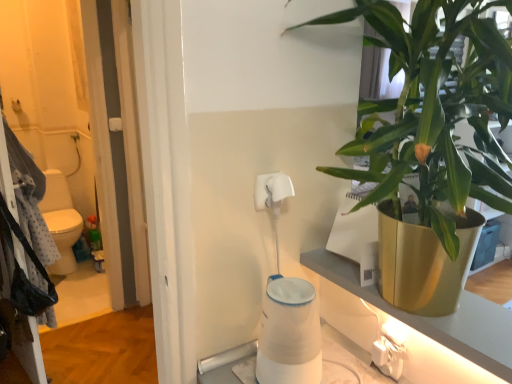
Question: Is point (381, 357) positioned closer to the camera than point (32, 276)?

Choices:
 (A) closer
 (B) farther

Answer: (A)

Question: Considering their positions, is white plastic electric outlet at lower right located in front of or behind spotted fabric laundry at left?

Choices:
 (A) behind
 (B) front

Answer: (B)

Question: Which object is the closest to the white matte toilet paper at upper center, which is the second toilet paper in bottom-to-top order?

Choices:
 (A) white matte toilet paper at center, which ranks as the second toilet paper in top-to-bottom order
 (B) spotted fabric laundry at left
 (C) white plastic electric outlet at lower right
 (D) green leafy plant at upper right

Answer: (A)

Question: Which object is the closest to the white matte toilet paper at center, which ranks as the second toilet paper in top-to-bottom order?

Choices:
 (A) spotted fabric laundry at left
 (B) white plastic electric outlet at lower right
 (C) white matte toilet paper at upper center, which ranks as the 1th toilet paper in top-to-bottom order
 (D) green leafy plant at upper right

Answer: (B)